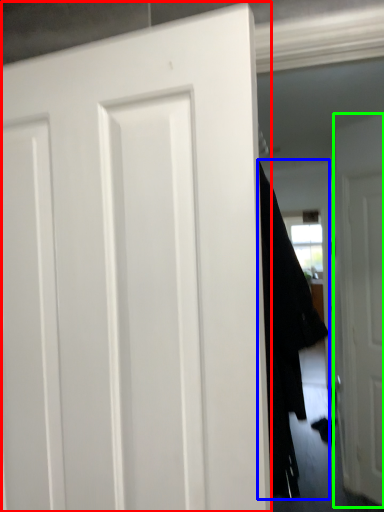
Question: Based on their relative distances, which object is nearer to door (highlighted by a red box)? Choose from garment (highlighted by a blue box) and door (highlighted by a green box).

Choices:
 (A) garment
 (B) door

Answer: (A)